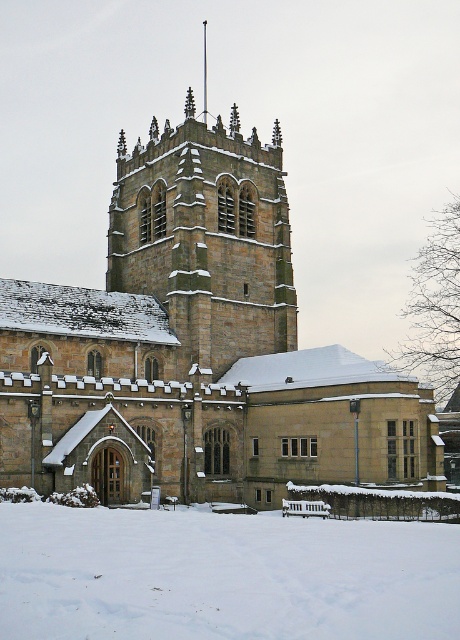
Between white powdery snow at lower center and brown stone tower at center, which one has less height?

white powdery snow at lower center is shorter.

At what (x,y) coordinates should I click in order to perform the action: click on white powdery snow at lower center. Please return your answer as a coordinate pair (x, y). The height and width of the screenshot is (640, 460). Looking at the image, I should click on (223, 576).

The image size is (460, 640). What are the coordinates of `white powdery snow at lower center` in the screenshot? It's located at 223,576.